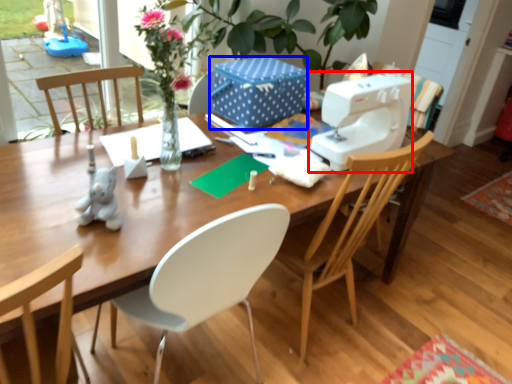
Question: Among these objects, which one is farthest to the camera, sewing machine (highlighted by a red box) or box (highlighted by a blue box)?

Choices:
 (A) sewing machine
 (B) box

Answer: (B)